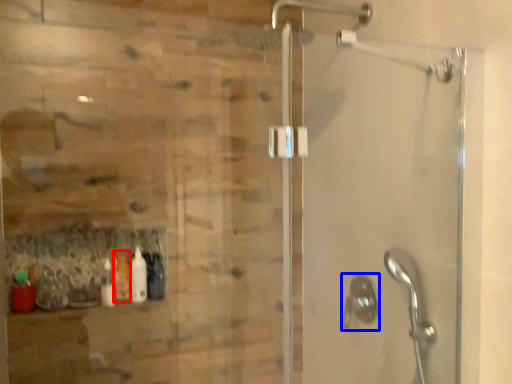
Question: Among these objects, which one is farthest to the camera, bottle (highlighted by a red box) or shower (highlighted by a blue box)?

Choices:
 (A) bottle
 (B) shower

Answer: (A)